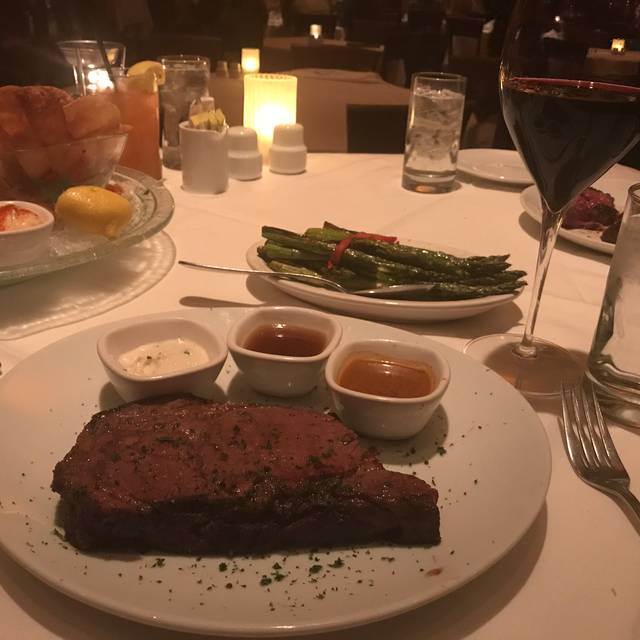
Locate an element on the screen. lit candle is located at coordinates (257, 100).